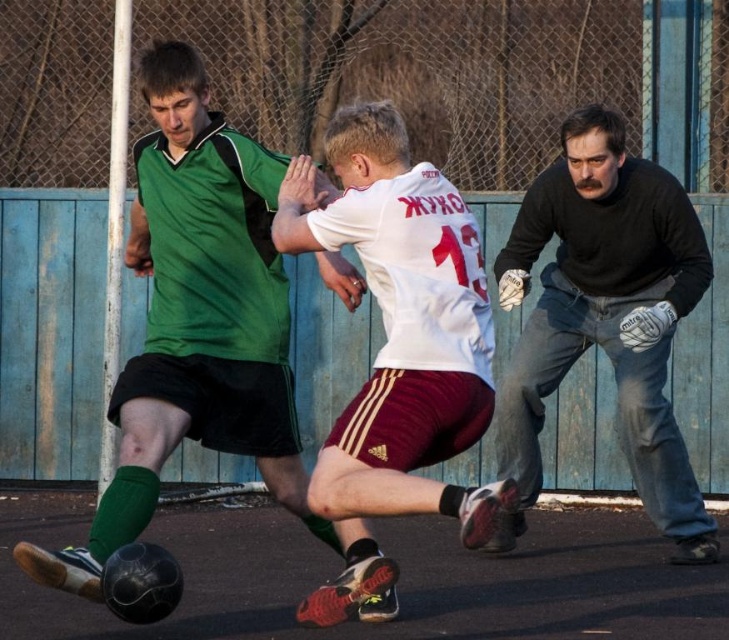
Question: Is matte green jersey at center closer to camera compared to white matte jersey at center?

Choices:
 (A) yes
 (B) no

Answer: (B)

Question: Does matte green jersey at center appear on the left side of black matte gloves at right?

Choices:
 (A) yes
 (B) no

Answer: (A)

Question: Which object is positioned farthest from the black matte gloves at right?

Choices:
 (A) white matte jersey at center
 (B) matte green jersey at center

Answer: (B)

Question: Which object is the closest to the white matte jersey at center?

Choices:
 (A) matte green jersey at center
 (B) black matte gloves at right

Answer: (A)

Question: Can you confirm if white matte jersey at center is positioned below black matte gloves at right?

Choices:
 (A) yes
 (B) no

Answer: (B)

Question: Which point is farther from the camera taking this photo?

Choices:
 (A) (343, 424)
 (B) (668, 208)
 (C) (273, 429)

Answer: (B)